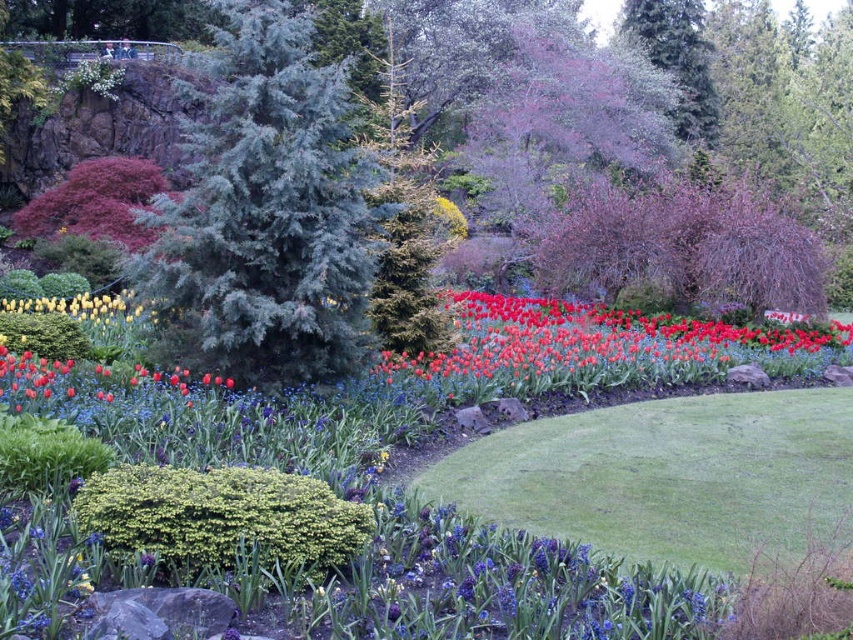
Question: Considering the real-world distances, which object is closest to the green textured pine tree at center?

Choices:
 (A) green textured bush at lower center
 (B) bright red petals at center
 (C) green textured evergreen tree at center

Answer: (C)

Question: Among these points, which one is nearest to the camera?

Choices:
 (A) [x=45, y=298]
 (B) [x=599, y=314]

Answer: (A)

Question: Can you confirm if bright red petals at center is bigger than green textured bush at lower center?

Choices:
 (A) no
 (B) yes

Answer: (B)

Question: Does green textured evergreen tree at center have a smaller size compared to bright red petals at center?

Choices:
 (A) no
 (B) yes

Answer: (A)

Question: Estimate the real-world distances between objects in this image. Which object is farther from the yellow matte tulip at left?

Choices:
 (A) bright red petals at center
 (B) green textured bush at lower center

Answer: (B)

Question: Can you confirm if green textured evergreen tree at center is positioned to the right of green textured pine tree at center?

Choices:
 (A) yes
 (B) no

Answer: (B)